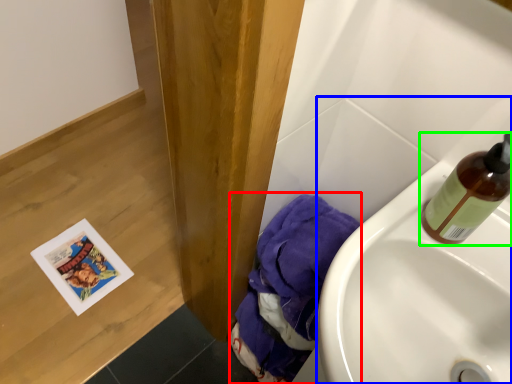
Question: Which object is positioned farthest from material (highlighted by a red box)? Select from sink (highlighted by a blue box) and bottle (highlighted by a green box).

Choices:
 (A) sink
 (B) bottle

Answer: (B)